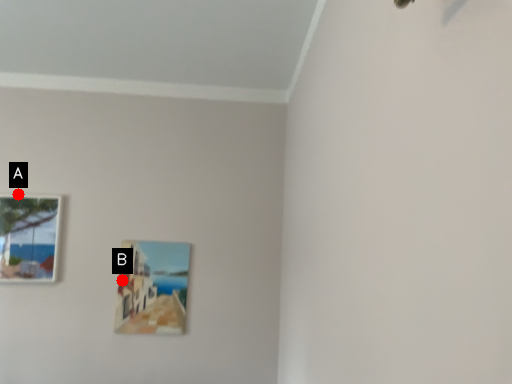
Question: Two points are circled on the image, labeled by A and B beside each circle. Which point is further to the camera?

Choices:
 (A) A is further
 (B) B is further

Answer: (A)